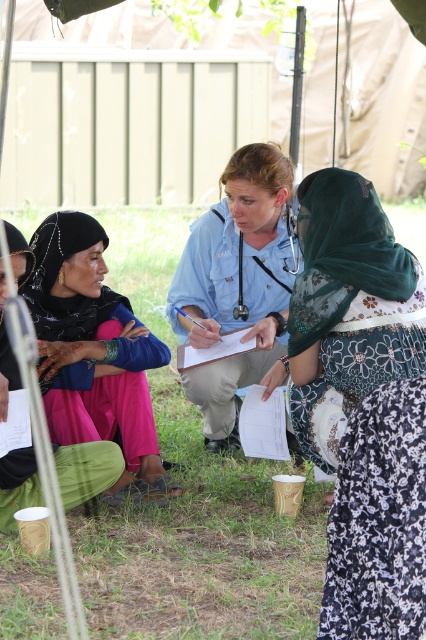
Question: Which point is closer to the camera taking this photo?

Choices:
 (A) (377, 298)
 (B) (247, 300)
 (C) (11, 593)
 (D) (80, 241)

Answer: (C)

Question: Which of the following is the farthest from the observer?

Choices:
 (A) (210, 284)
 (B) (230, 470)
 (C) (305, 349)

Answer: (A)

Question: Is white paper clipboard at center wider than metallic blue stethoscope at center?

Choices:
 (A) no
 (B) yes

Answer: (B)

Question: Which object is closer to the camera taking this photo?

Choices:
 (A) matte pink dress at lower left
 (B) metallic blue stethoscope at center
 (C) green floral dress at center

Answer: (C)

Question: Does blue uniform at center come in front of white paper clipboard at center?

Choices:
 (A) yes
 (B) no

Answer: (A)

Question: Is green grass at center below blue uniform at center?

Choices:
 (A) no
 (B) yes

Answer: (A)